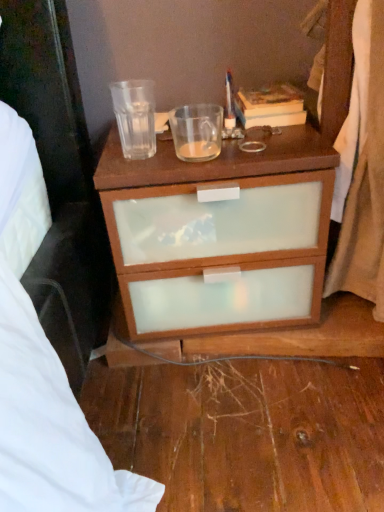
Locate an element on the screen. free point in front of transparent glass at upper center, marked as the 2th coffee cup in a right-to-left arrangement is located at coordinates (150, 154).